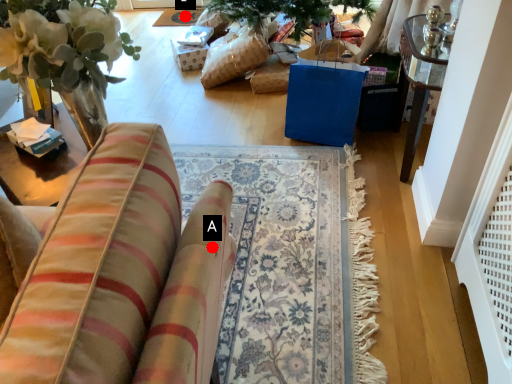
Question: Two points are circled on the image, labeled by A and B beside each circle. Among these points, which one is farthest from the camera?

Choices:
 (A) A is further
 (B) B is further

Answer: (B)